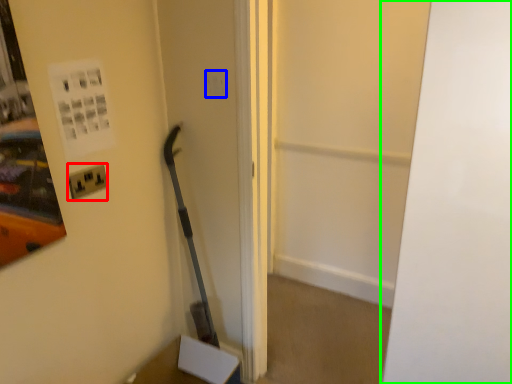
Question: Estimate the real-world distances between objects in this image. Which object is closer to electric outlet (highlighted by a red box), light switch (highlighted by a blue box) or door (highlighted by a green box)?

Choices:
 (A) light switch
 (B) door

Answer: (A)